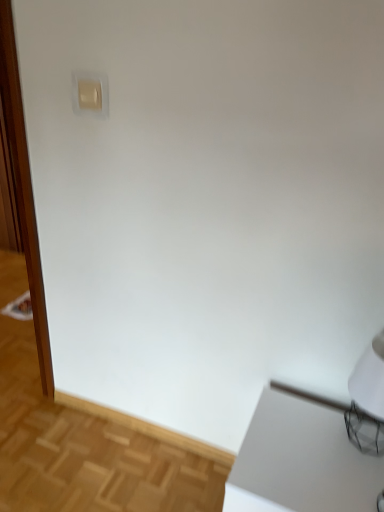
Find the location of a particular element. beige plastic light switch at upper left is located at coordinates (89, 94).

What do you see at coordinates (23, 188) in the screenshot? The width and height of the screenshot is (384, 512). I see `white glossy screen door at left` at bounding box center [23, 188].

Find the location of a particular element. Image resolution: width=384 pixels, height=512 pixels. white glossy table at lower right is located at coordinates (301, 461).

Identify the location of beige plastic light switch at upper left. The image size is (384, 512). (89, 94).

Based on the photo, from a real-world perspective, which object stands above the other?

white glossy screen door at left, from a real-world perspective.

Between white glossy screen door at left and white glossy table at lower right, which one is positioned behind?

white glossy screen door at left is behind.

Based on the photo, in the image, is white glossy screen door at left on the left side or the right side of white glossy table at lower right?

From the image, it's evident that white glossy screen door at left is to the left of white glossy table at lower right.

How many degrees apart are the facing directions of white glossy screen door at left and white glossy table at lower right?

The angle between the facing direction of white glossy screen door at left and the facing direction of white glossy table at lower right is 1.82 degrees.

Considering the relative sizes of white glossy screen door at left and white matte table lamp at lower right in the image provided, is white glossy screen door at left smaller than white matte table lamp at lower right?

Incorrect, white glossy screen door at left is not smaller in size than white matte table lamp at lower right.

Which is less distant, (44, 391) or (351, 392)?

Point (44, 391) appears to be farther away from the viewer than point (351, 392).

Where is `screen door located above the white matte table lamp at lower right (from a real-world perspective)`? screen door located above the white matte table lamp at lower right (from a real-world perspective) is located at coordinates (23, 188).

Is white glossy screen door at left with white matte table lamp at lower right?

No, white glossy screen door at left is not making contact with white matte table lamp at lower right.

There is a white glossy table at lower right. Where is `table lamp above it (from a real-world perspective)`? The image size is (384, 512). table lamp above it (from a real-world perspective) is located at coordinates (367, 400).

Is white matte table lamp at lower right inside or outside of white glossy table at lower right?

white matte table lamp at lower right is outside white glossy table at lower right.

Is white matte table lamp at lower right oriented towards white glossy table at lower right?

No, white matte table lamp at lower right does not turn towards white glossy table at lower right.

How distant is white glossy table at lower right from beige plastic light switch at upper left?

The distance of white glossy table at lower right from beige plastic light switch at upper left is 3.94 feet.

Which of these two, white glossy table at lower right or beige plastic light switch at upper left, is smaller?

Smaller between the two is beige plastic light switch at upper left.

Considering the relative sizes of white glossy table at lower right and beige plastic light switch at upper left in the image provided, is white glossy table at lower right shorter than beige plastic light switch at upper left?

No, white glossy table at lower right is not shorter than beige plastic light switch at upper left.

From the image's perspective, between white glossy table at lower right and beige plastic light switch at upper left, which one is located above?

From the image's view, beige plastic light switch at upper left is above.

Can white glossy screen door at left be found inside white matte table lamp at lower right?

No.

From the picture: From the image's perspective, is white matte table lamp at lower right above white glossy screen door at left?

No, from the image's perspective, white matte table lamp at lower right is not over white glossy screen door at left.

Which object is closer to the camera taking this photo, white matte table lamp at lower right or white glossy screen door at left?

white matte table lamp at lower right is closer to the camera.

Who is bigger, white matte table lamp at lower right or white glossy screen door at left?

white glossy screen door at left is bigger.

Is beige plastic light switch at upper left directly adjacent to white glossy table at lower right?

beige plastic light switch at upper left and white glossy table at lower right are clearly separated.

Which is behind, point (90, 80) or point (376, 462)?

The point (90, 80) is farther.

Can you confirm if beige plastic light switch at upper left is smaller than white glossy table at lower right?

Yes.

Is beige plastic light switch at upper left inside the boundaries of white glossy table at lower right, or outside?

beige plastic light switch at upper left is not enclosed by white glossy table at lower right.

Considering the sizes of objects beige plastic light switch at upper left and white matte table lamp at lower right in the image provided, who is shorter, beige plastic light switch at upper left or white matte table lamp at lower right?

beige plastic light switch at upper left is shorter.

From the image's perspective, between beige plastic light switch at upper left and white matte table lamp at lower right, who is located below?

white matte table lamp at lower right.

Is beige plastic light switch at upper left in contact with white matte table lamp at lower right?

No.

Is beige plastic light switch at upper left aimed at white matte table lamp at lower right?

No, beige plastic light switch at upper left does not turn towards white matte table lamp at lower right.

Locate an element on the screen. screen door above the white glossy table at lower right (from a real-world perspective) is located at coordinates (23, 188).

Where is `screen door above the white matte table lamp at lower right (from the image's perspective)`? Image resolution: width=384 pixels, height=512 pixels. screen door above the white matte table lamp at lower right (from the image's perspective) is located at coordinates (23, 188).

Which object lies nearer to the anchor point white glossy screen door at left, white glossy table at lower right or white matte table lamp at lower right?

white glossy table at lower right is closer to white glossy screen door at left.

Looking at the image, which one is located further to white matte table lamp at lower right, white glossy table at lower right or beige plastic light switch at upper left?

beige plastic light switch at upper left.

Considering their positions, is white glossy screen door at left positioned further to white matte table lamp at lower right than beige plastic light switch at upper left?

white glossy screen door at left lies further to white matte table lamp at lower right than the other object.

Which object lies further to the anchor point white glossy table at lower right, white matte table lamp at lower right or beige plastic light switch at upper left?

The object further to white glossy table at lower right is beige plastic light switch at upper left.

In the scene shown: Which object lies nearer to the anchor point white glossy screen door at left, white matte table lamp at lower right or beige plastic light switch at upper left?

The object closer to white glossy screen door at left is beige plastic light switch at upper left.

Looking at this image, looking at the image, which one is located further to white glossy screen door at left, white glossy table at lower right or beige plastic light switch at upper left?

Among the two, white glossy table at lower right is located further to white glossy screen door at left.

Which object lies further to the anchor point beige plastic light switch at upper left, white glossy screen door at left or white glossy table at lower right?

Among the two, white glossy screen door at left is located further to beige plastic light switch at upper left.

Considering their positions, is white glossy screen door at left positioned closer to white matte table lamp at lower right than white glossy table at lower right?

white glossy table at lower right is closer to white matte table lamp at lower right.

Locate an element on the screen. screen door between beige plastic light switch at upper left and white glossy table at lower right from top to bottom is located at coordinates (23, 188).

The width and height of the screenshot is (384, 512). Find the location of `table lamp between beige plastic light switch at upper left and white glossy table at lower right from top to bottom`. table lamp between beige plastic light switch at upper left and white glossy table at lower right from top to bottom is located at coordinates (367, 400).

At what (x,y) coordinates should I click in order to perform the action: click on table between white glossy screen door at left and white matte table lamp at lower right from left to right. Please return your answer as a coordinate pair (x, y). The width and height of the screenshot is (384, 512). Looking at the image, I should click on 301,461.

The width and height of the screenshot is (384, 512). I want to click on light switch between white glossy screen door at left and white matte table lamp at lower right, so click(x=89, y=94).